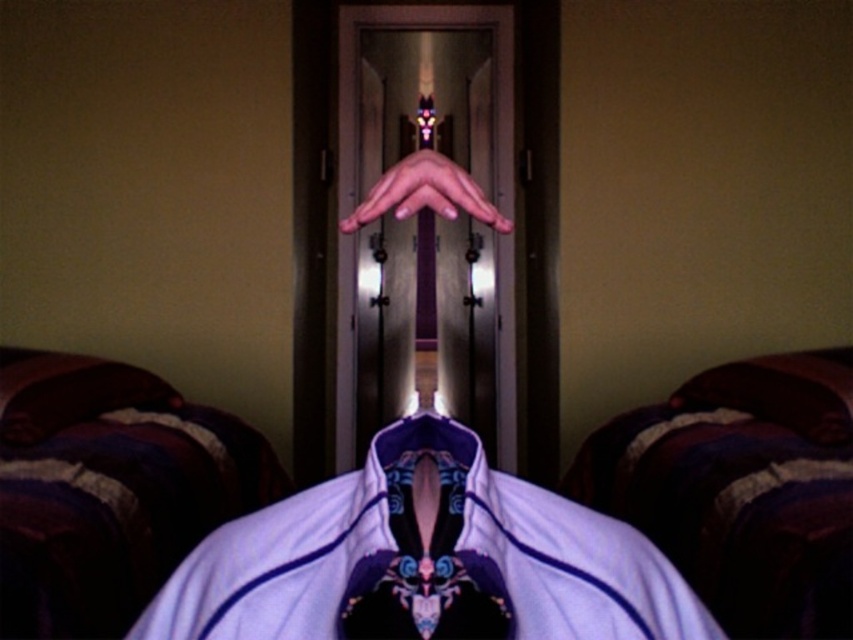
You are standing in a surreal scene with a metallic door and a pair of hands forming a heart shape. You notice a point marked at coordinates [425,560]. What object is located at that point?

The purple satin robe at center is located at point [425,560].

You are a fashion designer looking at this surreal image. You notice the white satin dress shirt at center and the matte purple hand at center. Which object is positioned to the right side of the other?

The white satin dress shirt at center is to the left of matte purple hand at center, so the matte purple hand at center is positioned to the right of the white satin dress shirt at center.

You are standing in a surreal room with a metallic door and a purple satin robe at center. To reach the door, you must step over the robe. Is the robe positioned in a way that you can step over it without touching it?

The purple satin robe at center is located at point (425,560), which places it directly in the path to the door. Since it is positioned centrally, stepping over it without touching would be possible if there is enough space around it. However, the exact dimensions of the robe are not provided, so caution is advised.